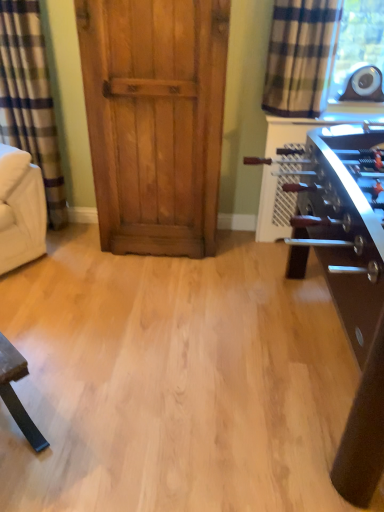
Question: Does shiny brown table at right have a lesser width compared to plaid fabric curtain at upper right, positioned as the first curtain in right-to-left order?

Choices:
 (A) no
 (B) yes

Answer: (A)

Question: From the image's perspective, does shiny brown table at right appear higher than plaid fabric curtain at upper right, positioned as the first curtain in right-to-left order?

Choices:
 (A) yes
 (B) no

Answer: (B)

Question: Considering the relative sizes of shiny brown table at right and plaid fabric curtain at upper right, positioned as the first curtain in right-to-left order, in the image provided, is shiny brown table at right wider than plaid fabric curtain at upper right, positioned as the first curtain in right-to-left order,?

Choices:
 (A) yes
 (B) no

Answer: (A)

Question: Is shiny brown table at right positioned far away from plaid fabric curtain at upper right, marked as the second curtain in a left-to-right arrangement?

Choices:
 (A) no
 (B) yes

Answer: (A)

Question: Can you confirm if shiny brown table at right is smaller than plaid fabric curtain at upper right, marked as the second curtain in a left-to-right arrangement?

Choices:
 (A) no
 (B) yes

Answer: (A)

Question: Considering the positions of point (168, 224) and point (13, 62), is point (168, 224) closer or farther from the camera than point (13, 62)?

Choices:
 (A) closer
 (B) farther

Answer: (B)

Question: In terms of height, does wooden door at center look taller or shorter compared to plaid fabric curtain at left, which appears as the first curtain when viewed from the left?

Choices:
 (A) short
 (B) tall

Answer: (B)

Question: In the image, is wooden door at center positioned in front of or behind plaid fabric curtain at left, which appears as the first curtain when viewed from the left?

Choices:
 (A) behind
 (B) front

Answer: (B)

Question: Would you say wooden door at center is to the left or to the right of plaid fabric curtain at left, which appears as the first curtain when viewed from the left, in the picture?

Choices:
 (A) right
 (B) left

Answer: (A)

Question: Is white fabric armchair at left bigger or smaller than shiny brown table at right?

Choices:
 (A) big
 (B) small

Answer: (B)

Question: From a real-world perspective, is white fabric armchair at left positioned above or below shiny brown table at right?

Choices:
 (A) above
 (B) below

Answer: (A)

Question: Is white fabric armchair at left inside or outside of shiny brown table at right?

Choices:
 (A) outside
 (B) inside

Answer: (A)

Question: From the image's perspective, is white fabric armchair at left above or below shiny brown table at right?

Choices:
 (A) above
 (B) below

Answer: (A)

Question: Considering the relative positions of wooden door at center and shiny brown table at right in the image provided, is wooden door at center to the left or to the right of shiny brown table at right?

Choices:
 (A) left
 (B) right

Answer: (A)

Question: Is wooden door at center in front of or behind shiny brown table at right in the image?

Choices:
 (A) behind
 (B) front

Answer: (A)